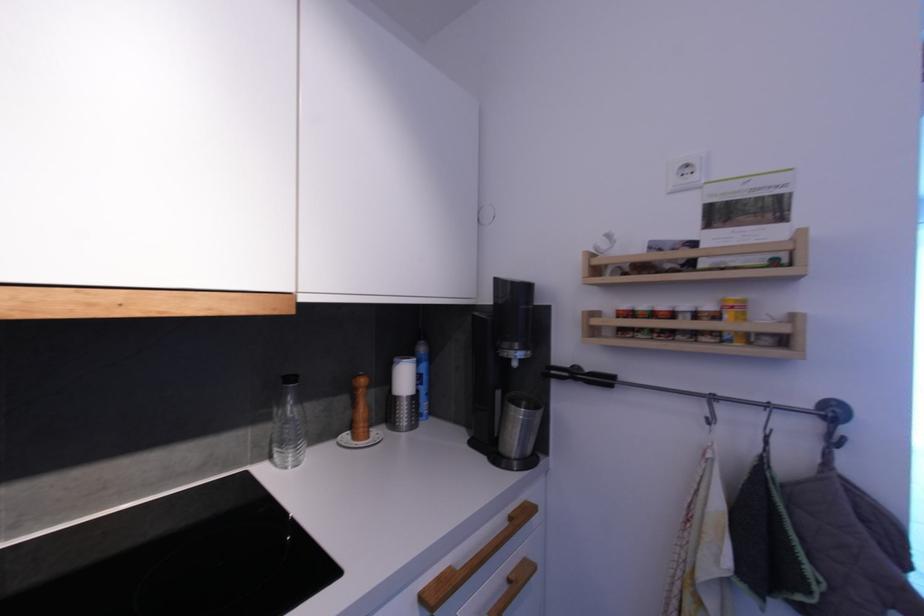
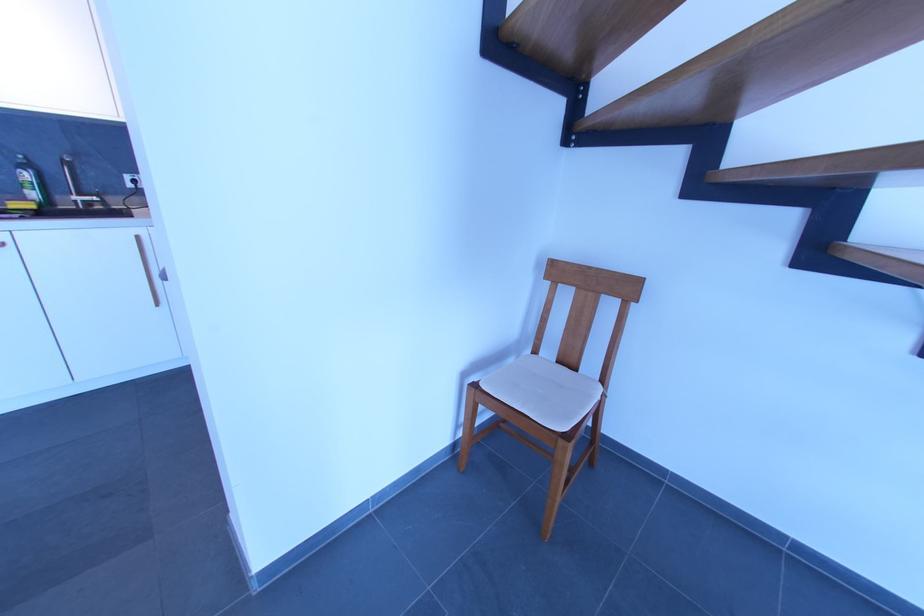
Question: I am providing you with two images of the same scene from different viewpoints. Which of the following objects are not visible in image2?

Choices:
 (A) small spice jar
 (B) green soap bottle
 (C) white pen holder
 (D) faucet handle

Answer: (A)